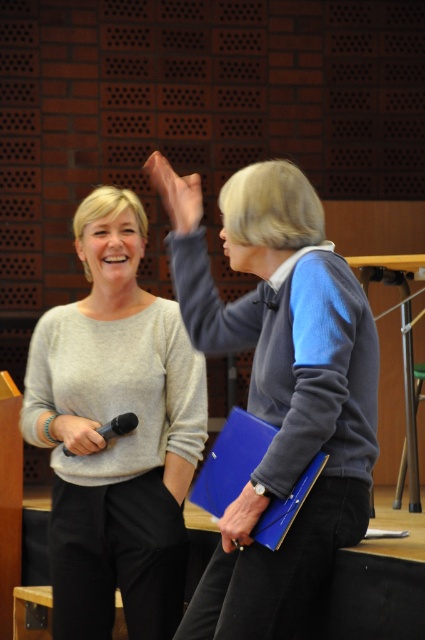
Can you confirm if blue corduroy sweater at center is positioned above matte gray sweater at center?

Correct, blue corduroy sweater at center is located above matte gray sweater at center.

Which is more to the right, blue corduroy sweater at center or matte gray sweater at center?

blue corduroy sweater at center

This screenshot has height=640, width=425. What do you see at coordinates (278, 387) in the screenshot? I see `blue corduroy sweater at center` at bounding box center [278, 387].

Find the location of `blue corduroy sweater at center`. blue corduroy sweater at center is located at coordinates (278, 387).